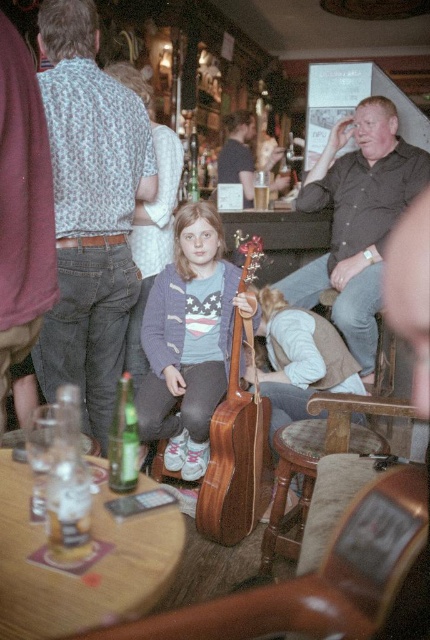
Question: Which point is closer to the camera taking this photo?

Choices:
 (A) (138, 444)
 (B) (132, 636)

Answer: (B)

Question: From the image, what is the correct spatial relationship of matte gray sweater at center in relation to knitted purple sweater at center?

Choices:
 (A) above
 (B) below

Answer: (B)

Question: Which of the following is the closest to the observer?

Choices:
 (A) (365, 426)
 (B) (61, 540)
 (C) (126, 452)

Answer: (B)

Question: Is dark brown shirt at upper right below translucent glass beer at table left?

Choices:
 (A) yes
 (B) no

Answer: (B)

Question: Which point appears closest to the camera in this image?

Choices:
 (A) (120, 401)
 (B) (356, 508)
 (C) (261, 208)
 (D) (190, 246)

Answer: (B)

Question: Is matte brown guitar at center to the right of dark brown leather jacket at upper right from the viewer's perspective?

Choices:
 (A) no
 (B) yes

Answer: (B)